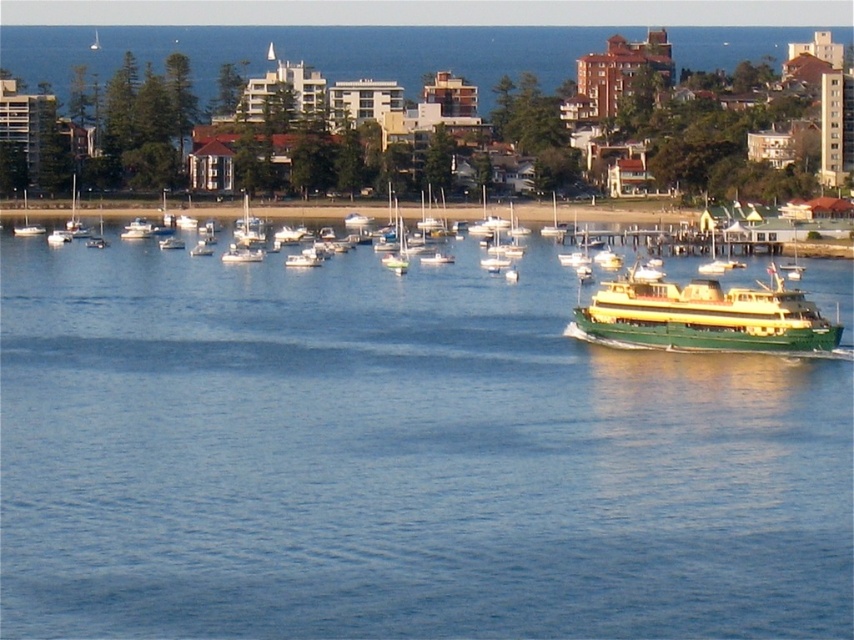
You are standing on a pier overlooking the blue water at center and the white matte sailboat at left. Which object is nearer to your position?

The blue water at center is closer to the viewer than the white matte sailboat at left.

You are a tour guide leading a group to the ferry terminal. The ferry is at the right side of the image. You want to inform your group how far the green polished ferry at right is from the blue water at center. What should you tell them?

The green polished ferry at right is 127.35 feet away from the blue water at center.